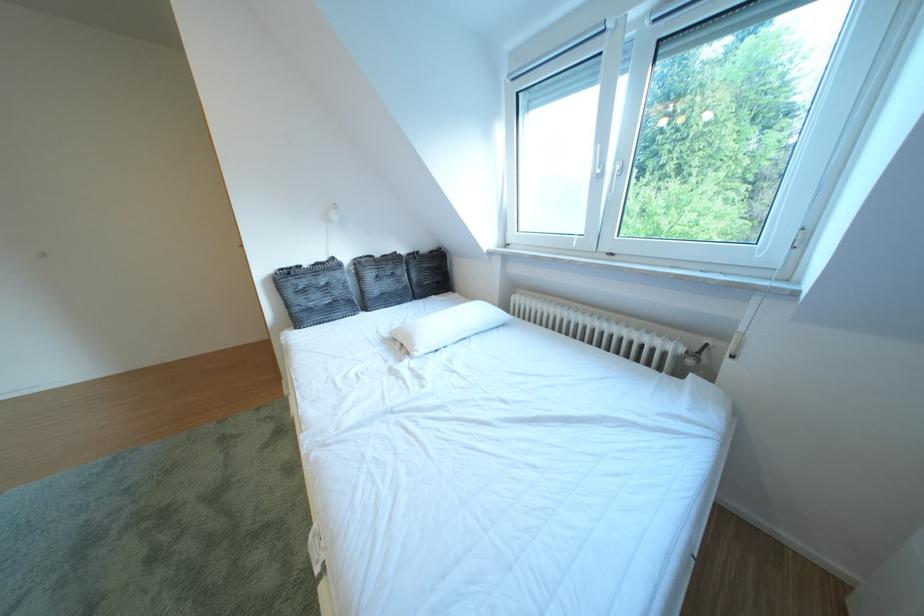
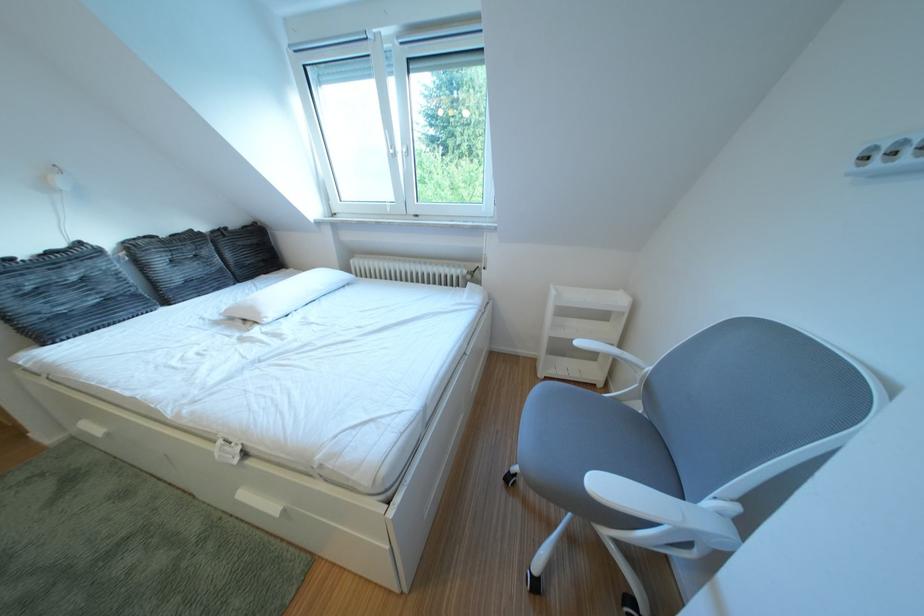
Question: The camera is either moving clockwise (left) or counter-clockwise (right) around the object. The first image is from the beginning of the video and the second image is from the end. Is the camera moving left or right when shooting the video?

Choices:
 (A) Left
 (B) Right

Answer: (A)